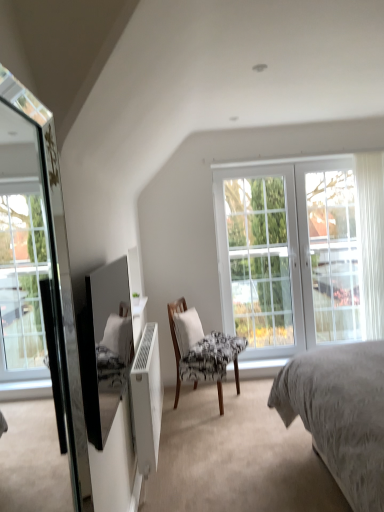
Where is `vacant space to the right of wooden chair with patterned fabric at center`? This screenshot has width=384, height=512. vacant space to the right of wooden chair with patterned fabric at center is located at coordinates (253, 396).